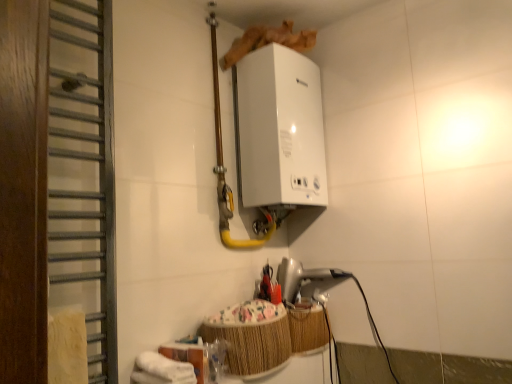
Question: From the image's perspective, does silver metallic hairdryer at lower center, which is the first appliance from bottom to top, appear higher than wooden towel rack at left?

Choices:
 (A) yes
 (B) no

Answer: (B)

Question: Is silver metallic hairdryer at lower center, which appears as the 2th appliance when viewed from the top, outside wooden towel rack at left?

Choices:
 (A) yes
 (B) no

Answer: (A)

Question: Is silver metallic hairdryer at lower center, which is the first appliance from bottom to top, at the right side of wooden towel rack at left?

Choices:
 (A) yes
 (B) no

Answer: (A)

Question: From the image's perspective, is silver metallic hairdryer at lower center, which is the first appliance from bottom to top, under wooden towel rack at left?

Choices:
 (A) no
 (B) yes

Answer: (B)

Question: From a real-world perspective, is silver metallic hairdryer at lower center, which appears as the 2th appliance when viewed from the top, located beneath wooden towel rack at left?

Choices:
 (A) yes
 (B) no

Answer: (A)

Question: Considering the relative positions of silver metallic hairdryer at lower center, which appears as the 2th appliance when viewed from the top, and white glossy pipe at upper center in the image provided, is silver metallic hairdryer at lower center, which appears as the 2th appliance when viewed from the top, to the left or to the right of white glossy pipe at upper center?

Choices:
 (A) right
 (B) left

Answer: (A)

Question: From the image's perspective, is silver metallic hairdryer at lower center, which appears as the 2th appliance when viewed from the top, located above or below white glossy pipe at upper center?

Choices:
 (A) below
 (B) above

Answer: (A)

Question: In terms of height, does silver metallic hairdryer at lower center, which is the first appliance from bottom to top, look taller or shorter compared to white glossy pipe at upper center?

Choices:
 (A) tall
 (B) short

Answer: (B)

Question: Is silver metallic hairdryer at lower center, which appears as the 2th appliance when viewed from the top, bigger or smaller than white glossy pipe at upper center?

Choices:
 (A) small
 (B) big

Answer: (A)

Question: Looking at their shapes, would you say white glossy boiler at upper center, which is the first appliance in top-to-bottom order, is wider or thinner than wooden towel rack at left?

Choices:
 (A) thin
 (B) wide

Answer: (B)

Question: Based on their positions, is white glossy boiler at upper center, which is the first appliance in top-to-bottom order, located to the left or right of wooden towel rack at left?

Choices:
 (A) right
 (B) left

Answer: (A)

Question: Choose the correct answer: Is white glossy boiler at upper center, the 2th appliance when ordered from bottom to top, inside wooden towel rack at left or outside it?

Choices:
 (A) inside
 (B) outside

Answer: (B)

Question: From a real-world perspective, is white glossy boiler at upper center, which is the first appliance in top-to-bottom order, positioned above or below wooden towel rack at left?

Choices:
 (A) above
 (B) below

Answer: (A)

Question: Is white glossy pipe at upper center wider or thinner than wooden towel rack at left?

Choices:
 (A) wide
 (B) thin

Answer: (A)

Question: From a real-world perspective, relative to wooden towel rack at left, is white glossy pipe at upper center vertically above or below?

Choices:
 (A) below
 (B) above

Answer: (B)